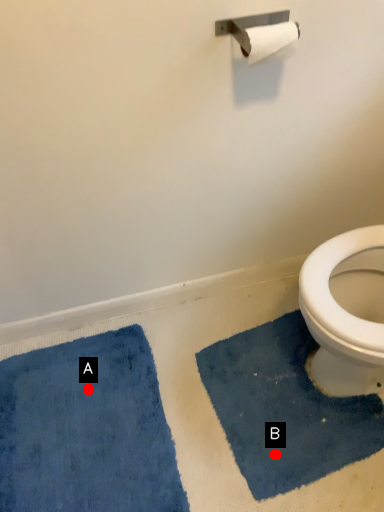
Question: Two points are circled on the image, labeled by A and B beside each circle. Which point is closer to the camera?

Choices:
 (A) A is closer
 (B) B is closer

Answer: (B)